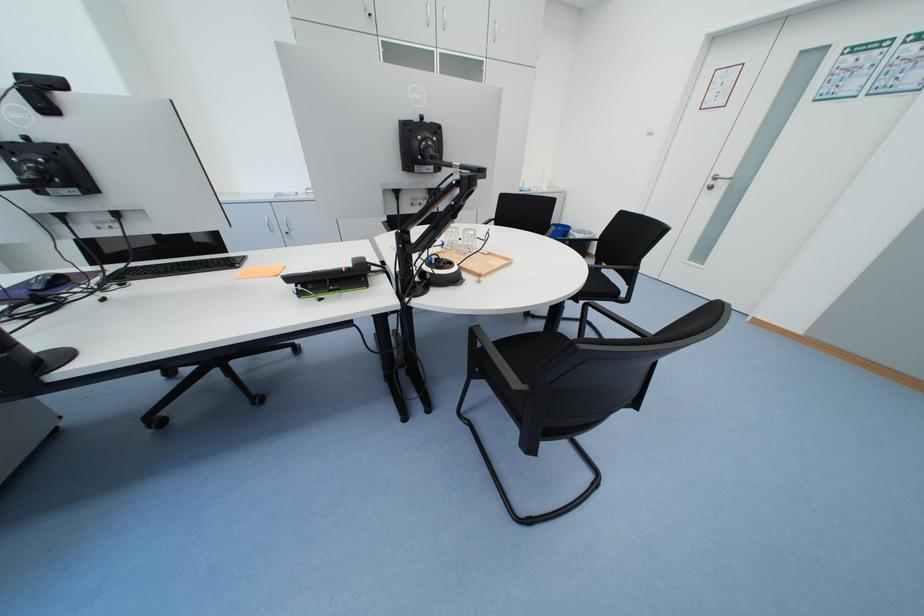
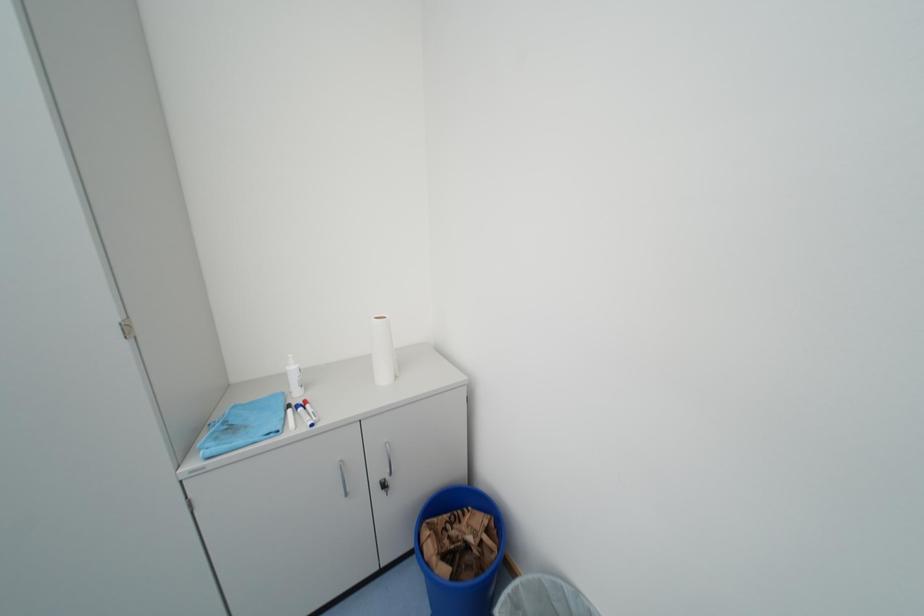
The images are taken continuously from a first-person perspective. In which direction are you moving?

The cameraman walked toward right, forward.